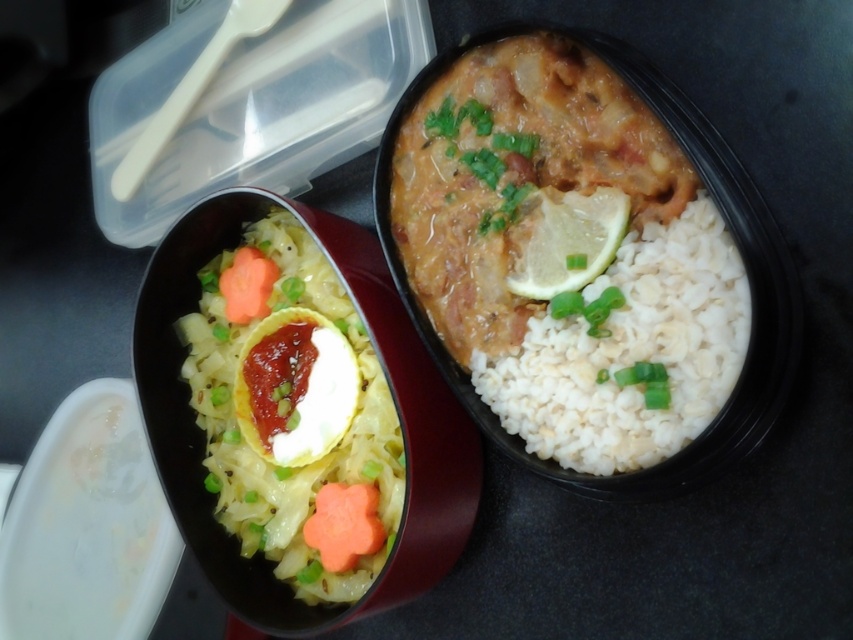
Is yellow matte lemon at upper right to the left of green leafy vegetable at center from the viewer's perspective?

No, yellow matte lemon at upper right is not to the left of green leafy vegetable at center.

Is point (543, 237) farther from viewer compared to point (436, 120)?

No, (543, 237) is in front of (436, 120).

Where is `yellow matte lemon at upper right`? This screenshot has width=853, height=640. yellow matte lemon at upper right is located at coordinates (570, 243).

Is yellow matte lemon at upper right wider than green chopped onion at center?

Yes, yellow matte lemon at upper right is wider than green chopped onion at center.

Can you confirm if yellow matte lemon at upper right is taller than green chopped onion at center?

Yes.

The image size is (853, 640). Find the location of `yellow matte lemon at upper right`. yellow matte lemon at upper right is located at coordinates (570, 243).

This screenshot has height=640, width=853. I want to click on yellow matte lemon at upper right, so click(570, 243).

Based on the photo, is white creamy rice at lower left above green leafy vegetable at center?

Actually, white creamy rice at lower left is below green leafy vegetable at center.

Image resolution: width=853 pixels, height=640 pixels. Identify the location of white creamy rice at lower left. (294, 413).